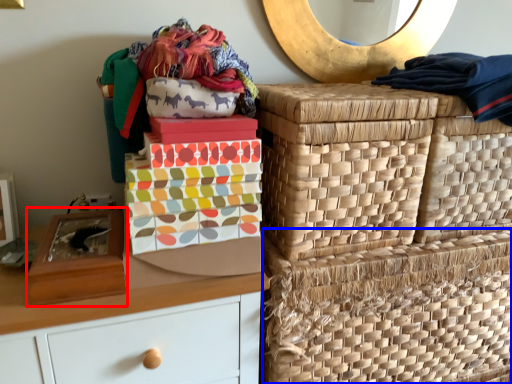
Question: Among these objects, which one is farthest to the camera, shoe box (highlighted by a red box) or basket (highlighted by a blue box)?

Choices:
 (A) shoe box
 (B) basket

Answer: (B)